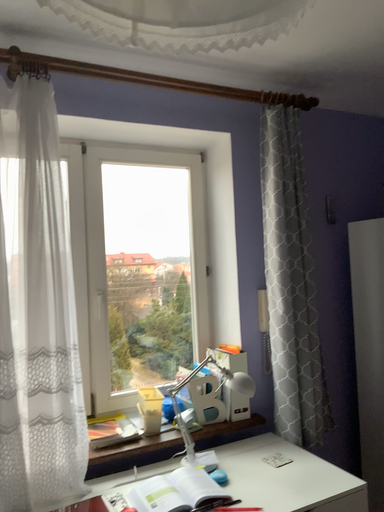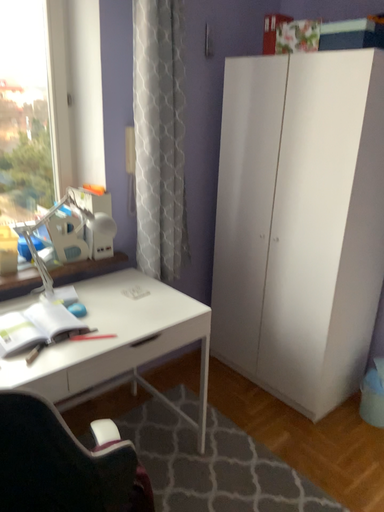
Question: How did the camera likely rotate when shooting the video?

Choices:
 (A) rotated upward
 (B) rotated downward

Answer: (B)